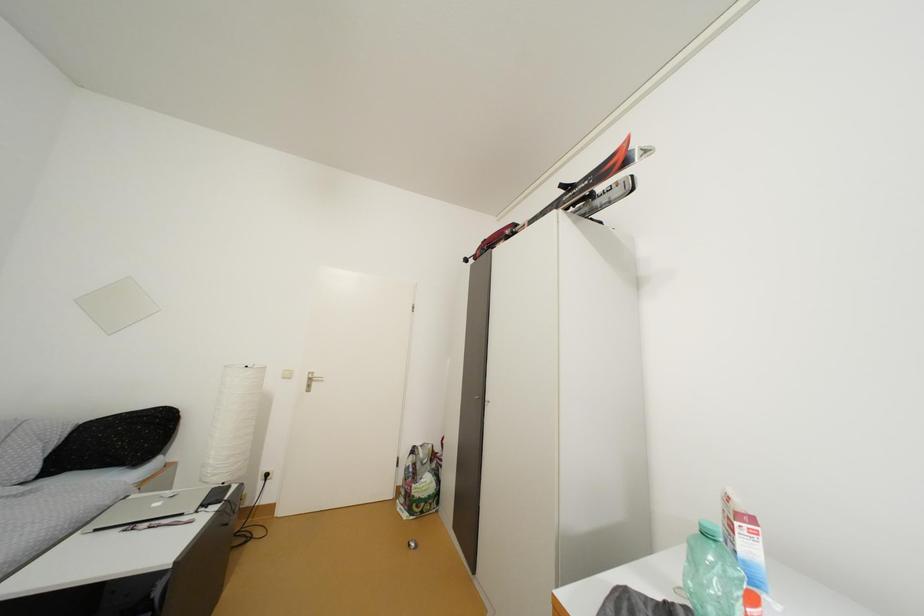
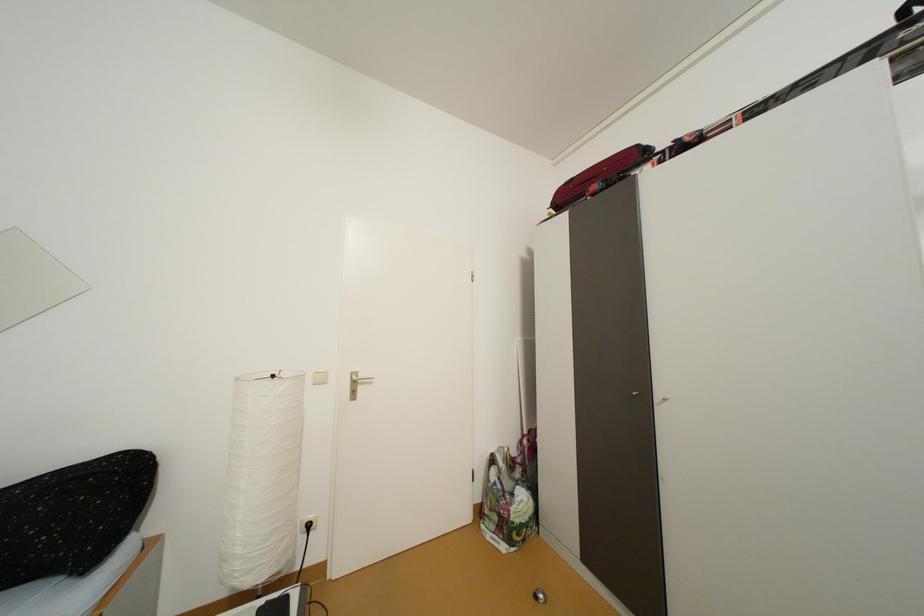
Question: The camera is either moving clockwise (left) or counter-clockwise (right) around the object. The first image is from the beginning of the video and the second image is from the end. Is the camera moving left or right when shooting the video?

Choices:
 (A) Left
 (B) Right

Answer: (A)